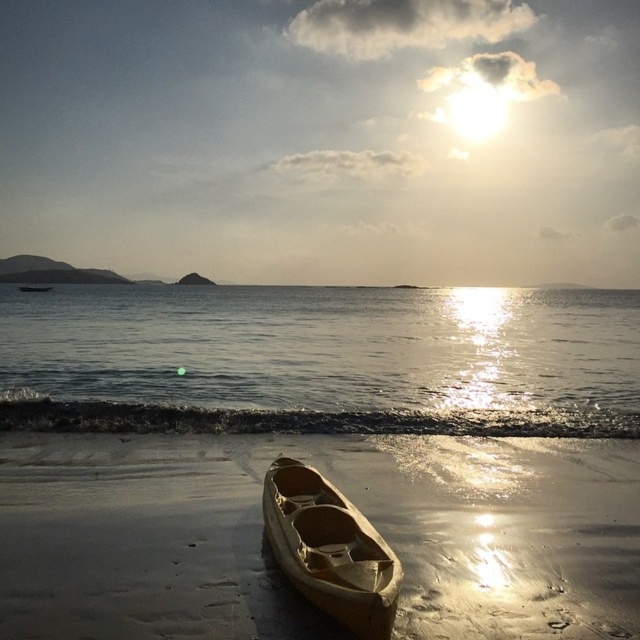
You are standing at the edge of the beach and want to place a small buoy exactly where the clear water at lower center is located. According to the coordinates provided, where should you place the buoy?

The clear water at lower center is located at coordinates point (x=321, y=360), so you should place the buoy there.

You are a photographer planning to capture the reflection of the sun in the scene. Given that you need a large enough flat surface, would the smooth sand at lower center or the clear water at lower center be a better choice for reflecting the sun?

The clear water at lower center occupies more space than the smooth sand at lower center, making it a better choice for reflecting the sun as it provides a larger flat surface.